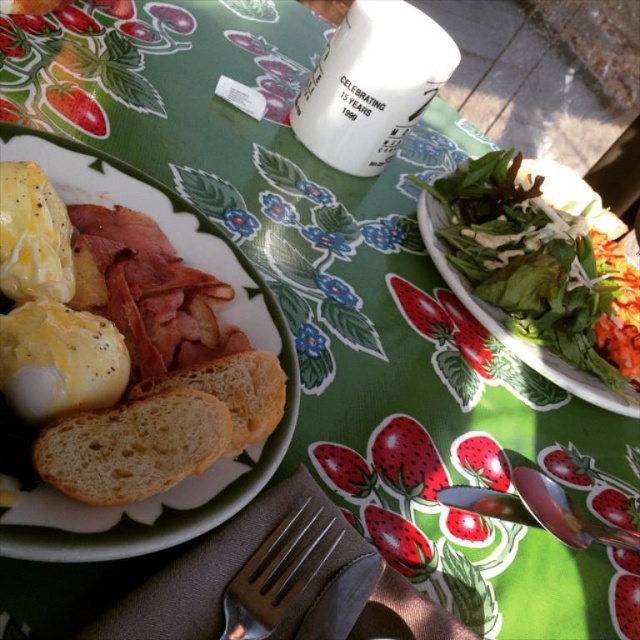
Question: Does green leafy salad at upper right have a larger size compared to brown crispy bread at center?

Choices:
 (A) no
 (B) yes

Answer: (B)

Question: Is the position of green leafy salad at upper right less distant than that of white matte plate at left?

Choices:
 (A) no
 (B) yes

Answer: (A)

Question: Which object appears farthest from the camera in this image?

Choices:
 (A) golden brown crusty bread at center
 (B) brown crispy bread at center

Answer: (B)

Question: Estimate the real-world distances between objects in this image. Which object is farther from the golden brown crusty bread at center?

Choices:
 (A) white matte plate at left
 (B) satin silver fork at lower center

Answer: (A)

Question: Which of the following is the closest to the observer?

Choices:
 (A) (273, 321)
 (B) (248, 612)
 (C) (618, 225)

Answer: (B)

Question: Does satin silver fork at lower center have a lesser width compared to brown crispy bread at center?

Choices:
 (A) no
 (B) yes

Answer: (B)